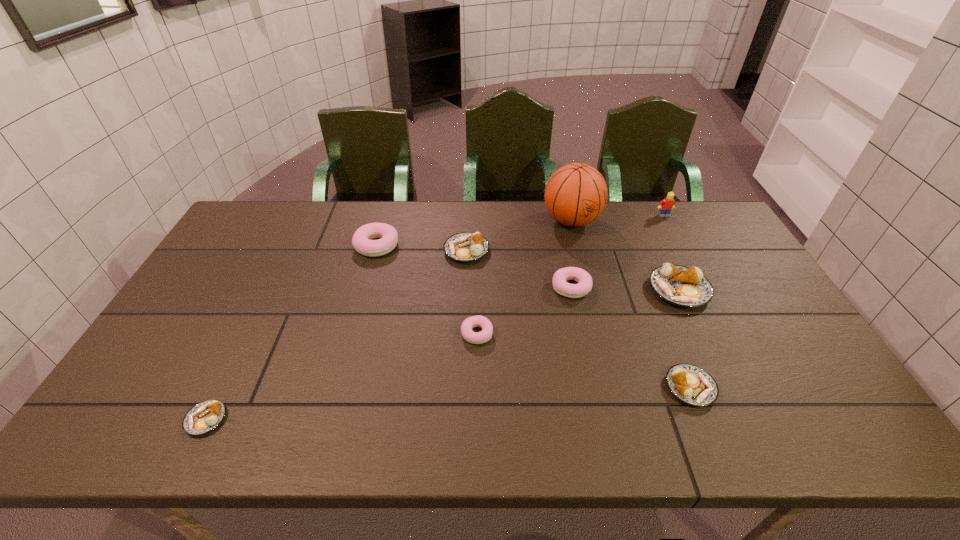
What are the coordinates of `the second farthest pink pastry` in the screenshot? It's located at (584, 286).

Identify the location of the third biggest brown pastry. (691, 384).

The height and width of the screenshot is (540, 960). Identify the location of the smallest pink pastry. (485, 335).

The width and height of the screenshot is (960, 540). In order to click on the third nearest object in this screenshot , I will do `click(485, 335)`.

Image resolution: width=960 pixels, height=540 pixels. I want to click on the leftmost object, so click(x=205, y=416).

You are a GUI agent. You are given a task and a screenshot of the screen. Output one action in this format:
    pyautogui.click(x=<x>, y=<y>)
    Task: Click on the leftmost brown pastry
    The width and height of the screenshot is (960, 540).
    Given the screenshot: What is the action you would take?
    pyautogui.click(x=205, y=416)

Locate an element on the screen. This screenshot has width=960, height=540. vacant space located 0.050m on the right of the basketball is located at coordinates (615, 221).

You are a GUI agent. You are given a task and a screenshot of the screen. Output one action in this format:
    pyautogui.click(x=<x>, y=<y>)
    Task: Click on the free space located on the front-facing side of the Lego
    This screenshot has height=540, width=960.
    Given the screenshot: What is the action you would take?
    pyautogui.click(x=677, y=240)

Locate an element on the screen. The width and height of the screenshot is (960, 540). vacant space located 0.120m on the left of the second farthest brown pastry is located at coordinates (609, 290).

I want to click on vacant region located 0.100m on the left of the second pastry from left to right, so click(324, 246).